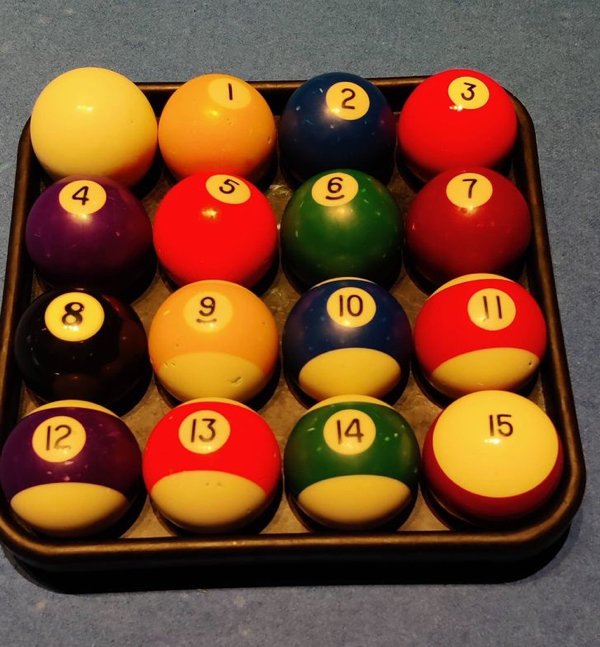
Locate an element on the screen. The height and width of the screenshot is (647, 600). bottom edge of tray is located at coordinates (302, 542).